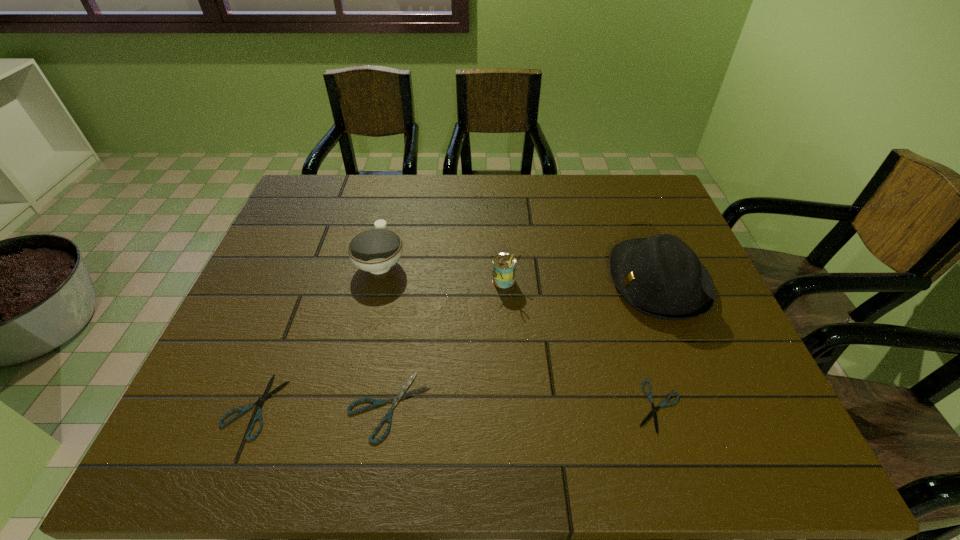
At what (x,y) coordinates should I click in order to perform the action: click on the second closest object to the second shortest object. Please return your answer as a coordinate pair (x, y). Image resolution: width=960 pixels, height=540 pixels. Looking at the image, I should click on (376, 250).

Locate an element on the screen. the closest shears to the chinaware is located at coordinates (400, 395).

The width and height of the screenshot is (960, 540). I want to click on the closest shears to the second shears from right to left, so click(x=265, y=396).

Locate an element on the screen. vacant position in the image that satisfies the following two spatial constraints: 1. on the front-facing side of the fedora; 2. on the front side of the second shears from right to left is located at coordinates (708, 406).

At what (x,y) coordinates should I click in order to perform the action: click on free point that satisfies the following two spatial constraints: 1. on the front side of the rightmost shears; 2. on the right side of the third object from right to left. Please return your answer as a coordinate pair (x, y). This screenshot has width=960, height=540. Looking at the image, I should click on (513, 407).